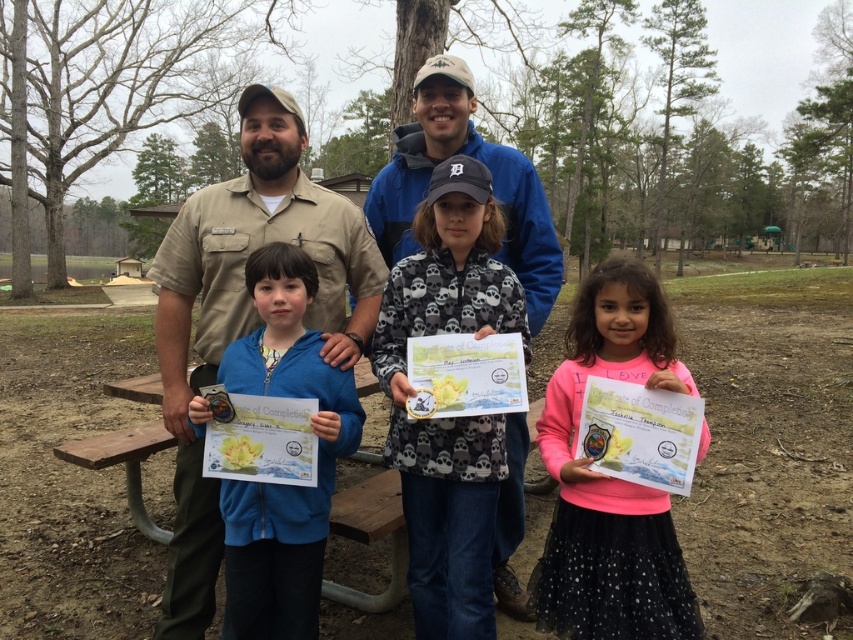
Can you confirm if black skull-patterned jacket at center is smaller than matte blue jacket at center?

No.

Between point (524, 300) and point (257, 100), which one is positioned in front?

Point (524, 300) is in front.

Where is `black skull-patterned jacket at center`? The image size is (853, 640). black skull-patterned jacket at center is located at coordinates (453, 417).

Does pink fabric dress at lower right have a smaller size compared to blue fleece jacket at center?

Indeed, pink fabric dress at lower right has a smaller size compared to blue fleece jacket at center.

Describe the element at coordinates (610, 476) in the screenshot. I see `pink fabric dress at lower right` at that location.

Who is more distant from viewer, (590, 461) or (286, 580)?

Result: The point (286, 580) is behind.

Find the location of a particular element. This screenshot has width=853, height=640. pink fabric dress at lower right is located at coordinates (610, 476).

Which is more to the right, black skull-patterned jacket at center or pink fabric dress at lower right?

pink fabric dress at lower right

Does black skull-patterned jacket at center have a lesser width compared to pink fabric dress at lower right?

No, black skull-patterned jacket at center is not thinner than pink fabric dress at lower right.

Is point (410, 285) in front of point (605, 328)?

No, it is not.

You are a GUI agent. You are given a task and a screenshot of the screen. Output one action in this format:
    pyautogui.click(x=<x>, y=<y>)
    Task: Click on the black skull-patterned jacket at center
    The image size is (853, 640).
    Given the screenshot: What is the action you would take?
    pyautogui.click(x=453, y=417)